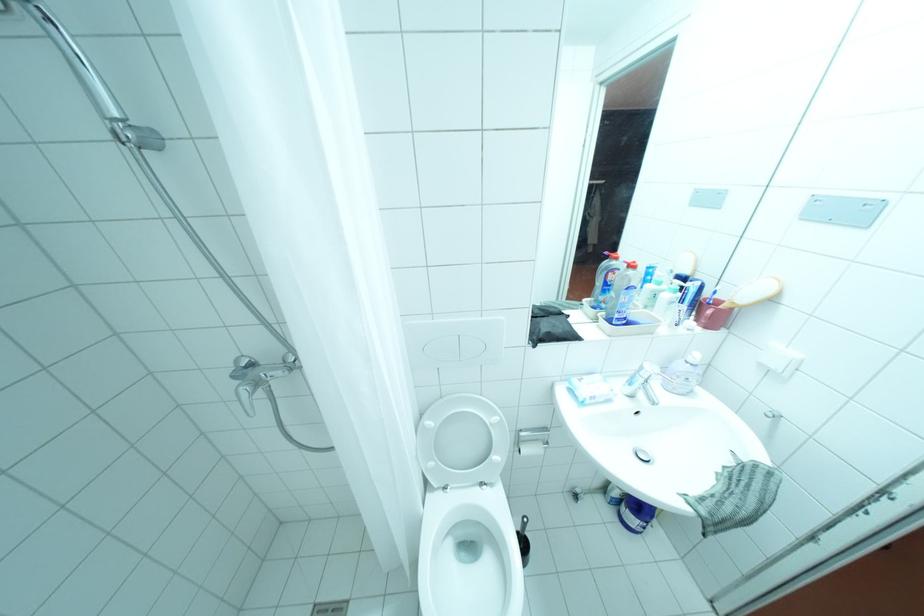
Which object does [685,286] point to?

It corresponds to the toothpaste tube in the image.